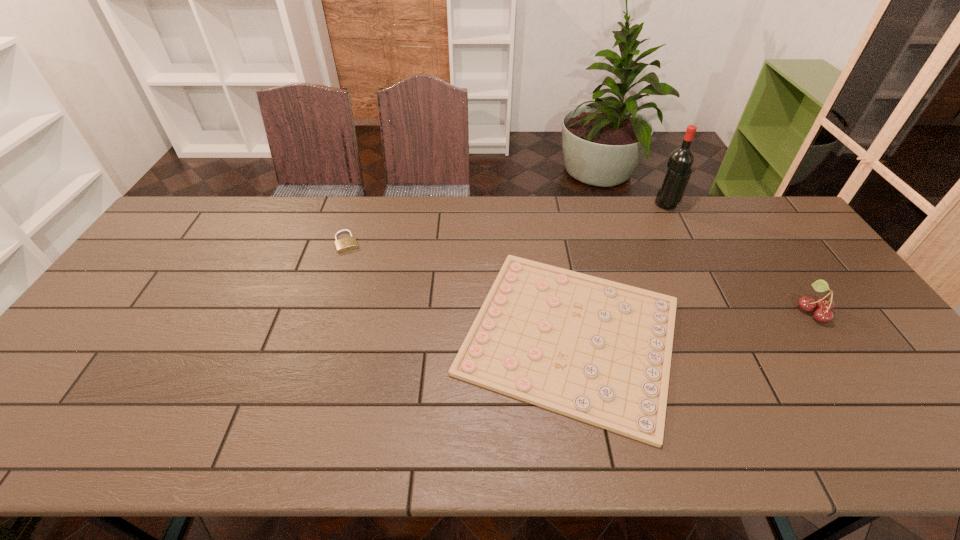
Image resolution: width=960 pixels, height=540 pixels. What are the coordinates of `the second object from right to left` in the screenshot? It's located at (679, 164).

Identify the location of the farthest object. (679, 164).

At what (x,y) coordinates should I click in order to perform the action: click on the rightmost object. Please return your answer as a coordinate pair (x, y). Looking at the image, I should click on (824, 305).

Find the location of a particular element. The height and width of the screenshot is (540, 960). cherry is located at coordinates (824, 305).

Locate an element on the screen. The image size is (960, 540). the leftmost object is located at coordinates tap(349, 243).

What are the coordinates of `padlock` in the screenshot? It's located at click(x=349, y=243).

Locate an element on the screen. gameboard is located at coordinates (599, 351).

This screenshot has height=540, width=960. Find the location of `the second object from left to right`. the second object from left to right is located at coordinates (599, 351).

This screenshot has height=540, width=960. In order to click on free spot located on the front of the farthest object in this screenshot , I will do `click(694, 260)`.

Where is `vacant space positioned 0.380m on the leaves of the rightmost object`? vacant space positioned 0.380m on the leaves of the rightmost object is located at coordinates (659, 311).